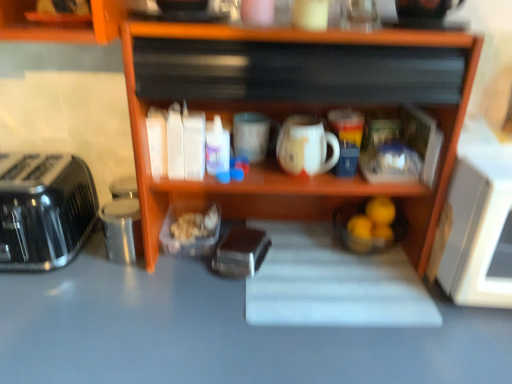
Locate an element on the screen. vacant area located to the right-hand side of metallic silver toaster at center is located at coordinates (308, 276).